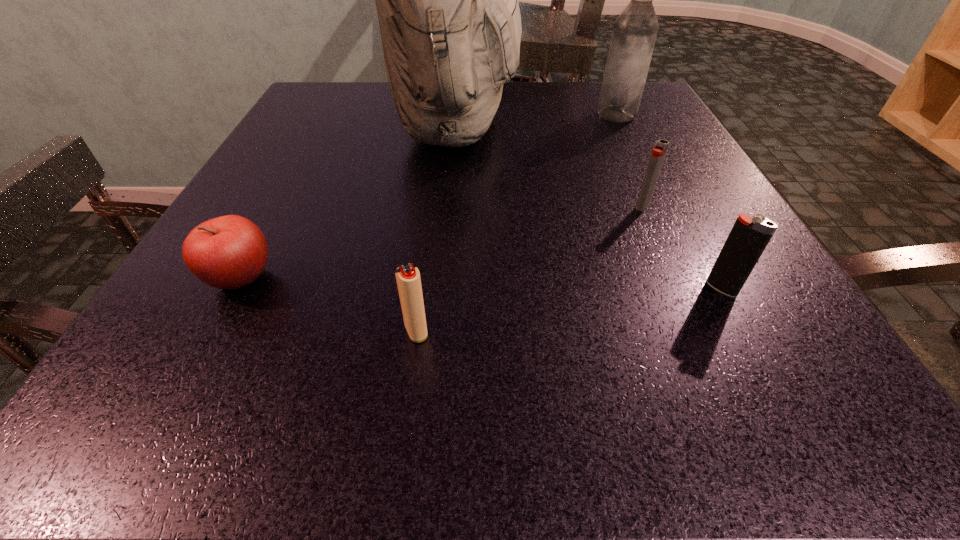
This screenshot has width=960, height=540. I want to click on free space at the left edge, so click(x=286, y=237).

The height and width of the screenshot is (540, 960). I want to click on vacant space at the right edge of the desktop, so click(x=631, y=215).

Locate an element on the screen. This screenshot has height=540, width=960. vacant position at the far left corner of the desktop is located at coordinates (337, 125).

The width and height of the screenshot is (960, 540). I want to click on vacant space at the near left corner of the desktop, so click(172, 418).

The height and width of the screenshot is (540, 960). Find the location of `free spot at the far right corner of the desktop`. free spot at the far right corner of the desktop is located at coordinates (587, 99).

I want to click on vacant area between the tallest object and the apple, so click(x=348, y=202).

This screenshot has width=960, height=540. In order to click on free space between the second tallest object and the apple in this screenshot , I will do `click(429, 197)`.

The image size is (960, 540). What are the coordinates of `unoccupied position between the backpack and the farthest igniter` in the screenshot? It's located at (549, 166).

The width and height of the screenshot is (960, 540). In order to click on blank region between the backpack and the second igniter from right to left in this screenshot , I will do `click(549, 166)`.

This screenshot has width=960, height=540. I want to click on unoccupied area between the second farthest igniter and the leftmost object, so click(481, 284).